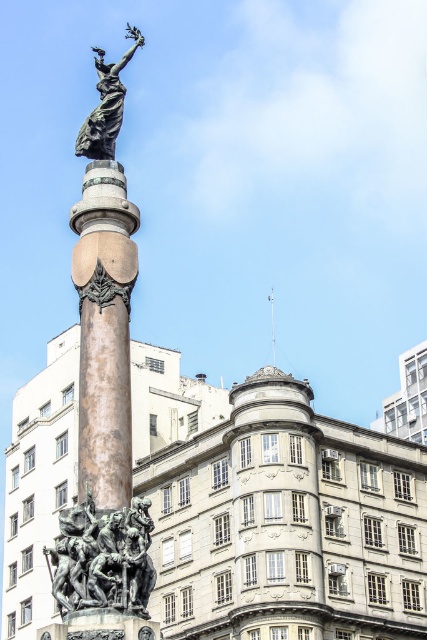
Looking at this image, you are standing in front of the monument and want to take a photo of the bronze statue at center and the bronze statue at upper center. Which one will appear closer to the camera in the photo?

The bronze statue at center appears closer to the camera because it is positioned in front of the bronze statue at upper center.

You are standing at the monument and want to locate the bronze statue. According to the map, the bronze statue is at point (102, 560). Based on the monument layout, where should you look to find the bronze statue?

The bronze statue is located at the lower left of the monument.

You are standing at the monument and want to take a photo. You notice two points marked on the monument. The first point is at coordinate point[131,589] and the second is at point[76,154]. Which point is closer to you if you are facing the monument?

Point[131,589] is in front of point[76,154], so it is closer to you when facing the monument.